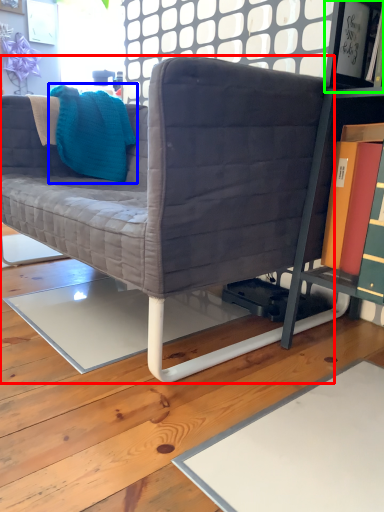
Question: Based on their relative distances, which object is farther from studio couch (highlighted by a red box)? Choose from throw pillow (highlighted by a blue box) and shelf (highlighted by a green box).

Choices:
 (A) throw pillow
 (B) shelf

Answer: (B)